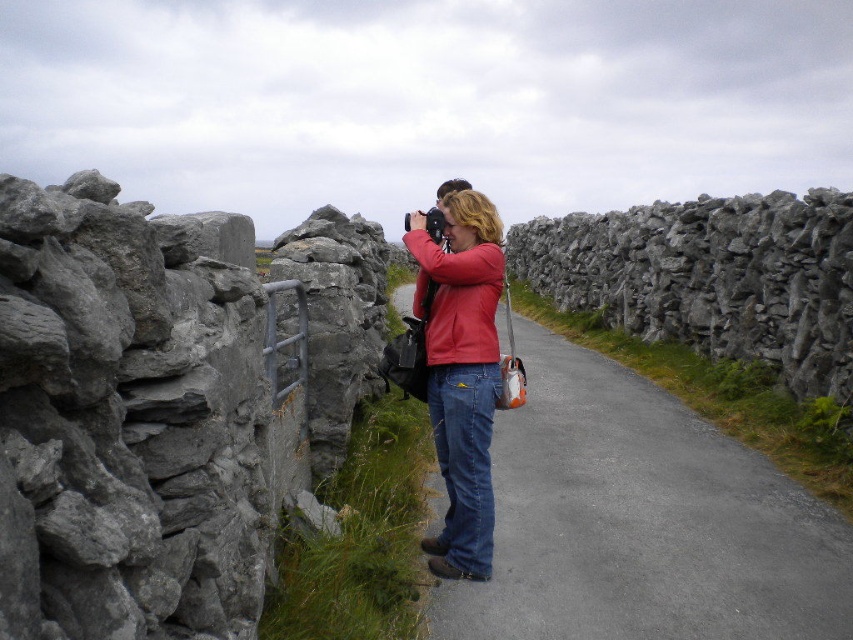
Question: Which point is closer to the camera?

Choices:
 (A) matte red jacket at center
 (B) gray rough stone at left
 (C) gray asphalt road at center
 (D) gray rough stone wall at right

Answer: (B)

Question: Is gray rough stone at left smaller than matte red jacket at center?

Choices:
 (A) no
 (B) yes

Answer: (A)

Question: Is the position of gray rough stone wall at right less distant than that of matte red jacket at center?

Choices:
 (A) no
 (B) yes

Answer: (A)

Question: Does gray rough stone at left appear on the right side of matte red jacket at center?

Choices:
 (A) no
 (B) yes

Answer: (A)

Question: Which point appears closest to the camera in this image?

Choices:
 (A) (461, 364)
 (B) (518, 316)
 (C) (555, 250)
 (D) (155, 426)

Answer: (D)

Question: Which object is closer to the camera taking this photo?

Choices:
 (A) gray rough stone at left
 (B) gray rough stone wall at right
 (C) gray asphalt road at center
 (D) matte red jacket at center

Answer: (A)